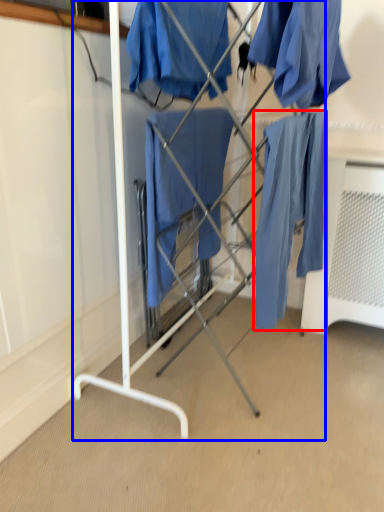
Question: Which object appears closest to the camera in this image, robe (highlighted by a red box) or furniture (highlighted by a blue box)?

Choices:
 (A) robe
 (B) furniture

Answer: (B)